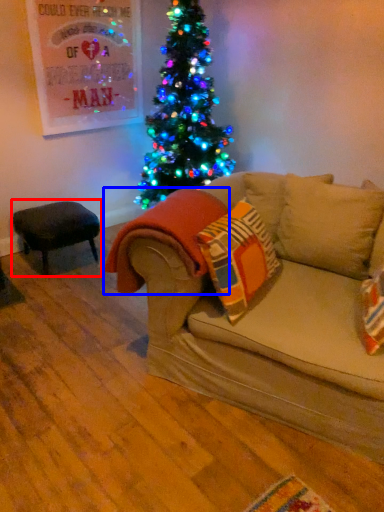
Question: Which object appears closest to the camera in this image, stool (highlighted by a red box) or blanket (highlighted by a blue box)?

Choices:
 (A) stool
 (B) blanket

Answer: (B)